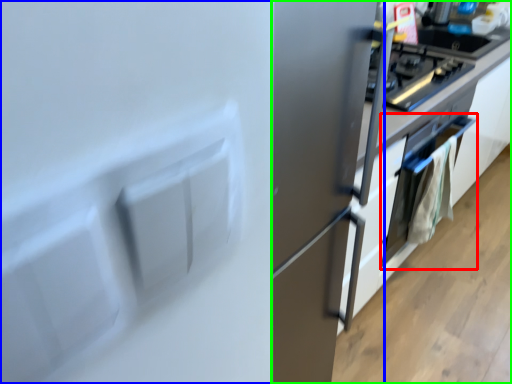
Question: Based on their relative distances, which object is farther from oven (highlighted by a red box)? Choose from fridge (highlighted by a blue box) and cabinetry (highlighted by a green box).

Choices:
 (A) fridge
 (B) cabinetry

Answer: (A)